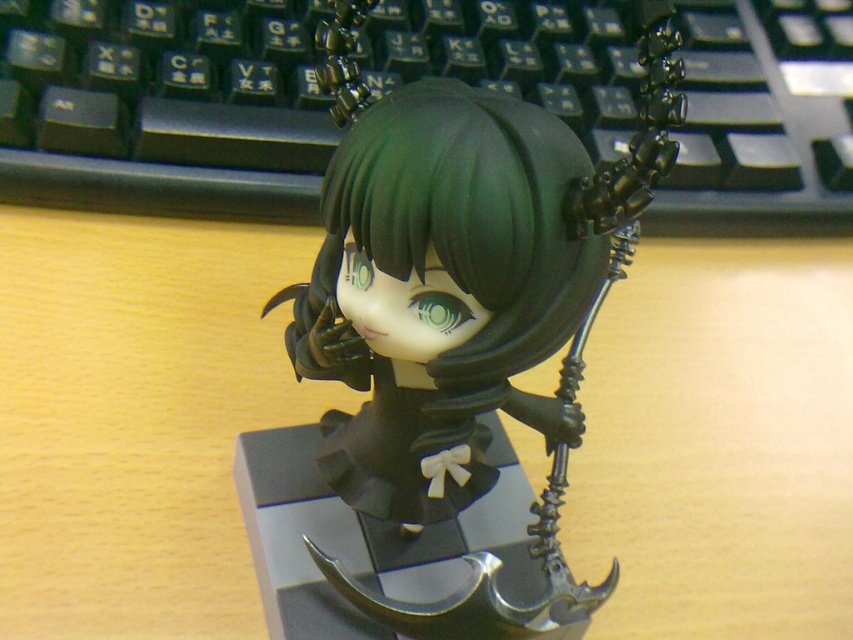
Image resolution: width=853 pixels, height=640 pixels. Describe the element at coordinates (163, 106) in the screenshot. I see `black plastic keyboard at upper center` at that location.

In the scene shown: Can you confirm if black plastic keyboard at upper center is taller than matte black figurine at center?

No.

The image size is (853, 640). Find the location of `black plastic keyboard at upper center`. black plastic keyboard at upper center is located at coordinates (163, 106).

At what (x,y) coordinates should I click in order to perform the action: click on black plastic keyboard at upper center. Please return your answer as a coordinate pair (x, y). The height and width of the screenshot is (640, 853). Looking at the image, I should click on (163, 106).